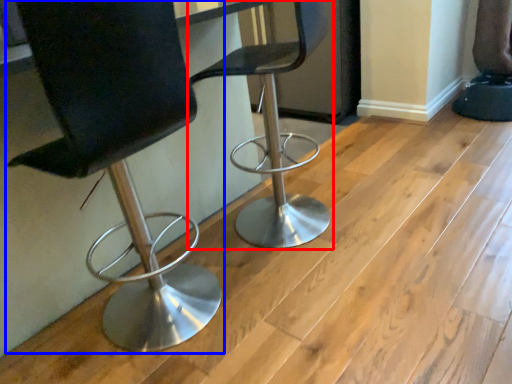
Question: Which object is closer to the camera taking this photo, chair (highlighted by a red box) or chair (highlighted by a blue box)?

Choices:
 (A) chair
 (B) chair

Answer: (B)